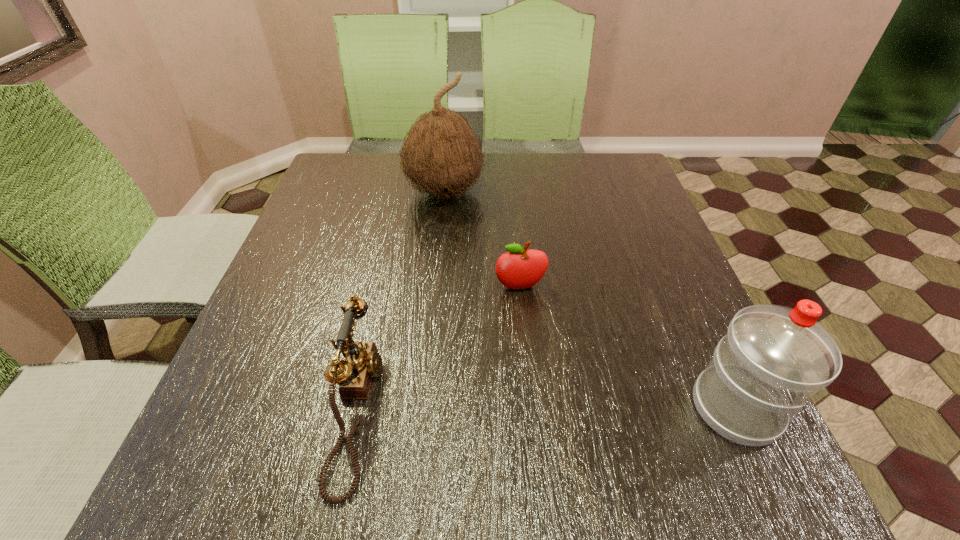
Locate an element on the screen. This screenshot has width=960, height=540. vacant space at the near edge is located at coordinates (526, 423).

Image resolution: width=960 pixels, height=540 pixels. Find the location of `free space at the left edge`. free space at the left edge is located at coordinates (359, 238).

Locate an element on the screen. vacant region at the right edge of the desktop is located at coordinates (684, 321).

In the image, there is a desktop. In order to click on free space at the far left corner in this screenshot , I will do `click(333, 181)`.

Image resolution: width=960 pixels, height=540 pixels. In the image, there is a desktop. Identify the location of vacant region at the far right corner. [x=602, y=194].

Find the location of `free point between the telephone and the water bottle`. free point between the telephone and the water bottle is located at coordinates (546, 408).

Where is `free space between the tallest object and the rightmost object`? The width and height of the screenshot is (960, 540). free space between the tallest object and the rightmost object is located at coordinates (590, 300).

You are a GUI agent. You are given a task and a screenshot of the screen. Output one action in this format:
    pyautogui.click(x=<x>, y=<y>)
    Task: Click on the vacant point located between the second farthest object and the coconut
    The image size is (960, 540).
    Given the screenshot: What is the action you would take?
    pyautogui.click(x=482, y=240)

Locate an element on the screen. This screenshot has height=540, width=960. vacant region between the telephone and the apple is located at coordinates (439, 348).

Where is `empty space that is in between the telephone and the apple`? The height and width of the screenshot is (540, 960). empty space that is in between the telephone and the apple is located at coordinates (439, 348).